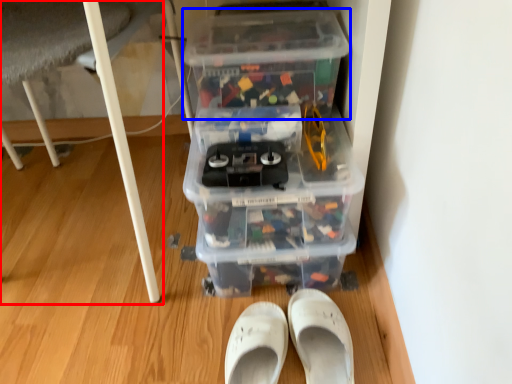
Question: Which object appears closest to the camera in this image, furniture (highlighted by a red box) or storage box (highlighted by a blue box)?

Choices:
 (A) furniture
 (B) storage box

Answer: (A)